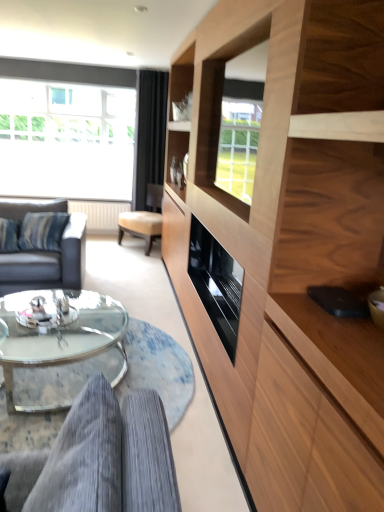
Question: From a real-world perspective, is gray corduroy couch at lower left, the first studio couch in the bottom-to-top sequence, positioned above or below transparent glass window at upper left?

Choices:
 (A) above
 (B) below

Answer: (B)

Question: Based on their positions, is gray corduroy couch at lower left, which ranks as the 2th studio couch in top-to-bottom order, located to the left or right of transparent glass window at upper left?

Choices:
 (A) left
 (B) right

Answer: (B)

Question: Which object is positioned closest to the transparent glass window at upper left?

Choices:
 (A) black velvet curtain at upper center
 (B) gray corduroy couch at lower left, which ranks as the 2th studio couch in top-to-bottom order
 (C) clear glass coffee table at lower center
 (D) dark gray leather couch at left, arranged as the second studio couch when viewed from the front
 (E) wooden cabinet at right

Answer: (A)

Question: Considering the real-world distances, which object is closest to the clear glass coffee table at lower center?

Choices:
 (A) gray corduroy couch at lower left, the first studio couch positioned from the right
 (B) dark gray leather couch at left, acting as the first studio couch starting from the left
 (C) transparent glass window at upper left
 (D) wooden cabinet at right
 (E) black velvet curtain at upper center

Answer: (B)